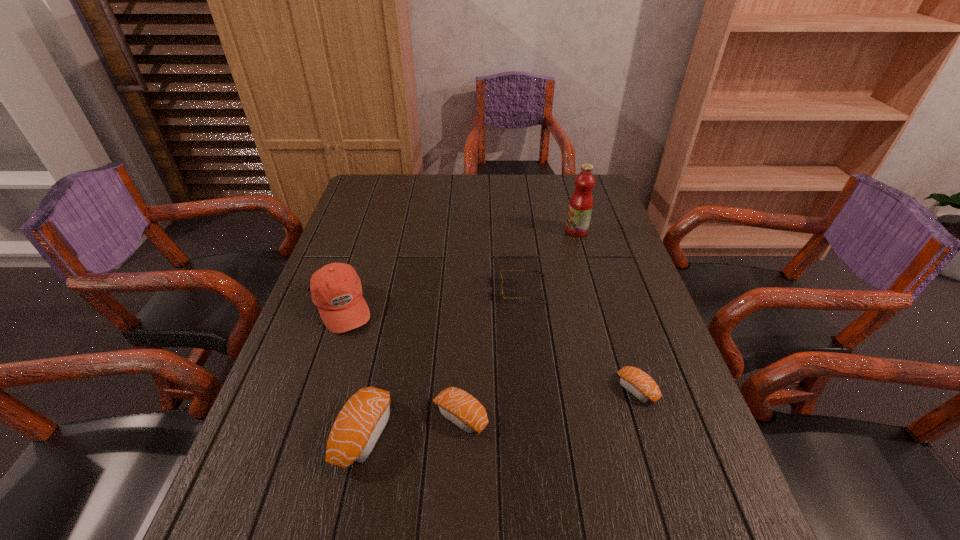
Find the location of `vacant space in between the rightmost sushi and the tallest sushi`. vacant space in between the rightmost sushi and the tallest sushi is located at coordinates (501, 411).

Image resolution: width=960 pixels, height=540 pixels. Identify the location of unoccupied position between the fifth shortest object and the leftmost sushi. (352, 370).

You are a GUI agent. You are given a task and a screenshot of the screen. Output one action in this format:
    pyautogui.click(x=<x>, y=<y>)
    Task: Click on the vacant area that lies between the tallest sushi and the third object from right to left
    
    Given the screenshot: What is the action you would take?
    pyautogui.click(x=444, y=361)

Locate an element on the screen. This screenshot has width=960, height=540. free spot between the third shortest object and the tallest sushi is located at coordinates (412, 425).

Locate an element on the screen. The height and width of the screenshot is (540, 960). vacant area that lies between the rightmost sushi and the fourth object from left to right is located at coordinates (581, 339).

Identify the location of vacant area that lies between the baseball cap and the leftmost sushi. Image resolution: width=960 pixels, height=540 pixels. (352, 370).

Locate an element on the screen. free space between the second sushi from right to left and the fruit juice is located at coordinates (518, 324).

Select which object is the third closest to the fourth shortest object. Please provide its 2D coordinates. Your answer should be formatted as a tuple, i.e. [(x, y)], where the tuple contains the x and y coordinates of a point satisfying the conditions above.

[(501, 280)]

Identify which object is located as the third nearest to the sunglasses. Please provide its 2D coordinates. Your answer should be formatted as a tuple, i.e. [(x, y)], where the tuple contains the x and y coordinates of a point satisfying the conditions above.

[(459, 407)]

Locate which sushi ranks in proximity to the shortest sushi. Please provide its 2D coordinates. Your answer should be formatted as a tuple, i.e. [(x, y)], where the tuple contains the x and y coordinates of a point satisfying the conditions above.

[(459, 407)]